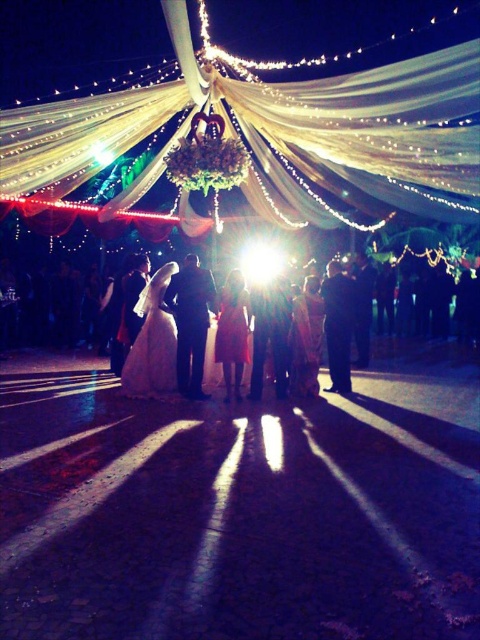
You are a photographer at the wedding and want to position yourself to capture the entire illuminated sheer fabric canopy at upper center in your shot. Given that your camera has a fixed focal length, which direction should you move relative to the canopy to ensure it fits entirely within the frame?

To capture the entire illuminated sheer fabric canopy at upper center, you should move backward from the canopy since it is positioned at point (273, 134), indicating it is closer to the camera. Moving backward will allow the canopy to fit within the frame without being cropped.

You are a photographer at the wedding. You want to take a photo of the white satin dress at center without the illuminated sheer fabric canopy at upper center blocking it. Is this possible given their positions?

The illuminated sheer fabric canopy at upper center is in front of the white satin dress at center, so it is blocking the view. To capture the white satin dress at center without obstruction, you would need to reposition yourself or the subjects so that the canopy is no longer between you and the dress.